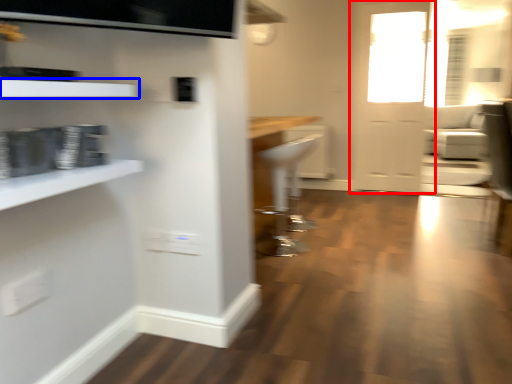
Question: Among these objects, which one is farthest to the camera, door (highlighted by a red box) or shelf (highlighted by a blue box)?

Choices:
 (A) door
 (B) shelf

Answer: (A)